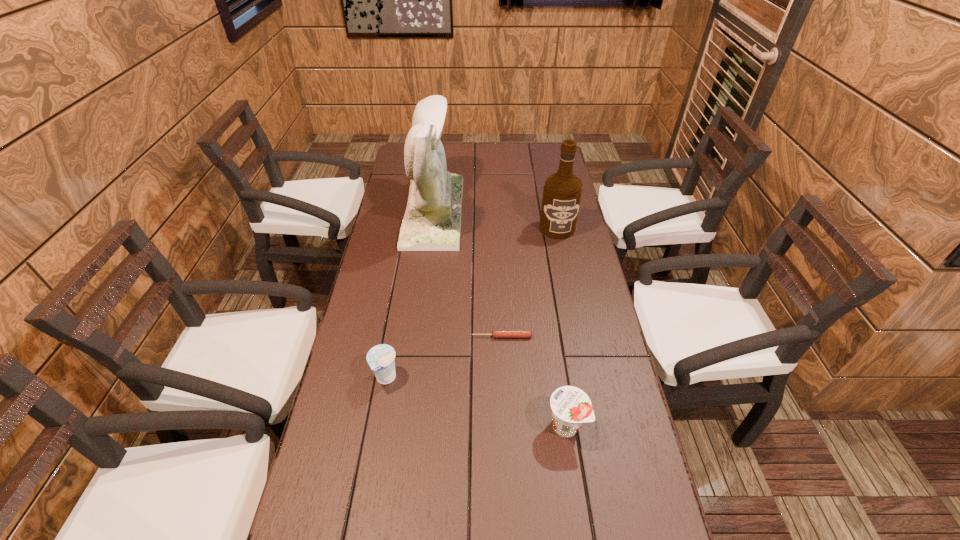
The height and width of the screenshot is (540, 960). Find the location of `vacant space at the far right corner of the desktop`. vacant space at the far right corner of the desktop is located at coordinates (536, 158).

Locate an element on the screen. vacant area between the nearer yogurt and the left yogurt is located at coordinates (476, 402).

The image size is (960, 540). Find the location of `unoccupied area between the nearer yogurt and the alcohol`. unoccupied area between the nearer yogurt and the alcohol is located at coordinates (562, 327).

The image size is (960, 540). Find the location of `free space between the nearest object and the alcohol`. free space between the nearest object and the alcohol is located at coordinates (562, 327).

The height and width of the screenshot is (540, 960). Find the location of `vacant space that is in between the third object from right to left and the sculpture`. vacant space that is in between the third object from right to left and the sculpture is located at coordinates (468, 274).

Find the location of a particular element. The width and height of the screenshot is (960, 540). free space between the sculpture and the fourth farthest object is located at coordinates (410, 295).

Where is `vacant region between the tallest object and the nearest object`? This screenshot has height=540, width=960. vacant region between the tallest object and the nearest object is located at coordinates (499, 318).

Image resolution: width=960 pixels, height=540 pixels. Identify the location of vacant area between the second tallest object and the sausage. (530, 282).

Where is `empty space that is in between the tallest object and the third object from right to left`? The width and height of the screenshot is (960, 540). empty space that is in between the tallest object and the third object from right to left is located at coordinates (468, 274).

The height and width of the screenshot is (540, 960). I want to click on vacant area between the alcohol and the farther yogurt, so click(471, 303).